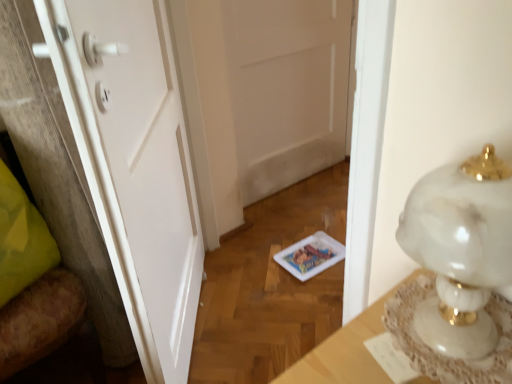
Question: Does white matte door at center, the first door when ordered from right to left, have a lesser width compared to white marble table at right?

Choices:
 (A) no
 (B) yes

Answer: (B)

Question: From a real-world perspective, is white matte door at center, which ranks as the 2th door in left-to-right order, beneath white marble table at right?

Choices:
 (A) no
 (B) yes

Answer: (B)

Question: Could you tell me if white matte door at center, the first door when ordered from right to left, is facing white marble table at right?

Choices:
 (A) yes
 (B) no

Answer: (B)

Question: From the image's perspective, is white matte door at center, the first door when ordered from right to left, located above white marble table at right?

Choices:
 (A) no
 (B) yes

Answer: (B)

Question: Is white matte door at center, which ranks as the 2th door in left-to-right order, at the left side of white marble table at right?

Choices:
 (A) yes
 (B) no

Answer: (A)

Question: In the image, is white marble lamp at right on the left side or the right side of white matte door at center, the second door when ordered from front to back?

Choices:
 (A) right
 (B) left

Answer: (A)

Question: From a real-world perspective, is white marble lamp at right above or below white matte door at center, the first door when ordered from right to left?

Choices:
 (A) above
 (B) below

Answer: (A)

Question: Considering the positions of point (444, 168) and point (273, 28), is point (444, 168) closer or farther from the camera than point (273, 28)?

Choices:
 (A) closer
 (B) farther

Answer: (A)

Question: Is white marble lamp at right taller or shorter than white matte door at center, acting as the first door starting from the back?

Choices:
 (A) short
 (B) tall

Answer: (A)

Question: From a real-world perspective, relative to wooden chair at left, is white matte door at center, the first door when ordered from right to left, vertically above or below?

Choices:
 (A) below
 (B) above

Answer: (B)

Question: From the image's perspective, relative to wooden chair at left, is white matte door at center, the second door when ordered from front to back, above or below?

Choices:
 (A) above
 (B) below

Answer: (A)

Question: Considering the relative positions of white matte door at center, acting as the first door starting from the back, and wooden chair at left in the image provided, is white matte door at center, acting as the first door starting from the back, to the left or to the right of wooden chair at left?

Choices:
 (A) left
 (B) right

Answer: (B)

Question: Is white matte door at center, which ranks as the 2th door in left-to-right order, in front of or behind wooden chair at left in the image?

Choices:
 (A) behind
 (B) front

Answer: (A)

Question: Based on their positions, is white matte door at center, acting as the first door starting from the back, located to the left or right of white marble lamp at right?

Choices:
 (A) right
 (B) left

Answer: (B)

Question: In the image, is white matte door at center, which ranks as the 2th door in left-to-right order, positioned in front of or behind white marble lamp at right?

Choices:
 (A) behind
 (B) front

Answer: (A)